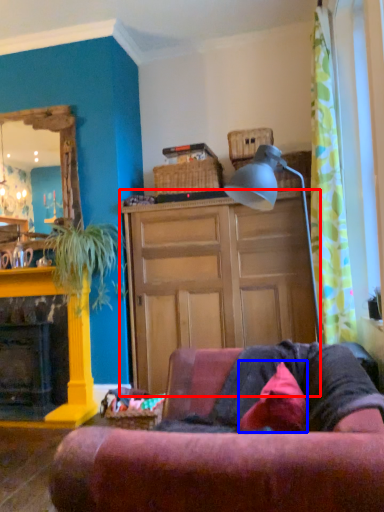
Question: Which object is closer to the camera taking this photo, cabinetry (highlighted by a red box) or pillow (highlighted by a blue box)?

Choices:
 (A) cabinetry
 (B) pillow

Answer: (B)